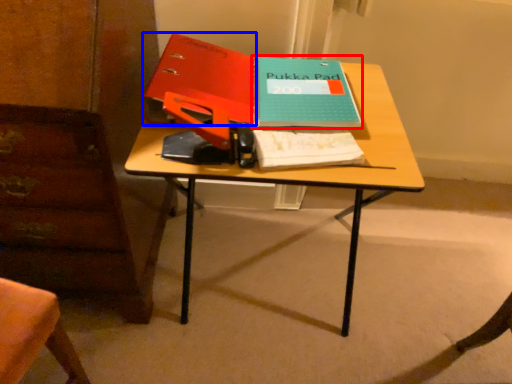
Question: Which object appears closest to the camera in this image, paperback book (highlighted by a red box) or paperback book (highlighted by a blue box)?

Choices:
 (A) paperback book
 (B) paperback book

Answer: (B)